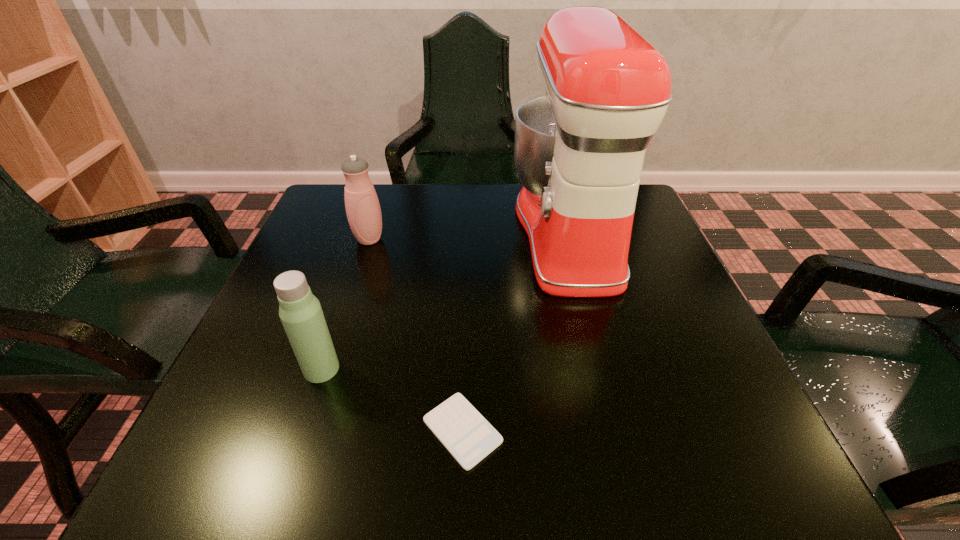
Locate an element on the screen. Image resolution: width=960 pixels, height=540 pixels. vacant space that's between the calculator and the tallest object is located at coordinates (516, 332).

The height and width of the screenshot is (540, 960). Find the location of `vacant space that is in between the farther thermos bottle and the rightmost object`. vacant space that is in between the farther thermos bottle and the rightmost object is located at coordinates (468, 237).

Locate an element on the screen. The width and height of the screenshot is (960, 540). free space between the mixer and the farther thermos bottle is located at coordinates (468, 237).

Locate an element on the screen. The height and width of the screenshot is (540, 960). unoccupied position between the mixer and the third farthest object is located at coordinates (445, 301).

Identify which object is the second closest to the nearer thermos bottle. Please provide its 2D coordinates. Your answer should be formatted as a tuple, i.e. [(x, y)], where the tuple contains the x and y coordinates of a point satisfying the conditions above.

[(363, 210)]

You are a GUI agent. You are given a task and a screenshot of the screen. Output one action in this format:
    pyautogui.click(x=<x>, y=<y>)
    Task: Click on the second closest object relative to the farther thermos bottle
    This screenshot has height=540, width=960.
    Given the screenshot: What is the action you would take?
    pyautogui.click(x=300, y=311)

Image resolution: width=960 pixels, height=540 pixels. Find the location of `vacant space that satisfies the following two spatial constraints: 1. on the front-facing side of the mixer; 2. on the front side of the farther thermos bottle`. vacant space that satisfies the following two spatial constraints: 1. on the front-facing side of the mixer; 2. on the front side of the farther thermos bottle is located at coordinates (570, 239).

Locate an element on the screen. This screenshot has height=540, width=960. blank area in the image that satisfies the following two spatial constraints: 1. on the back side of the farther thermos bottle; 2. on the right side of the third farthest object is located at coordinates (365, 239).